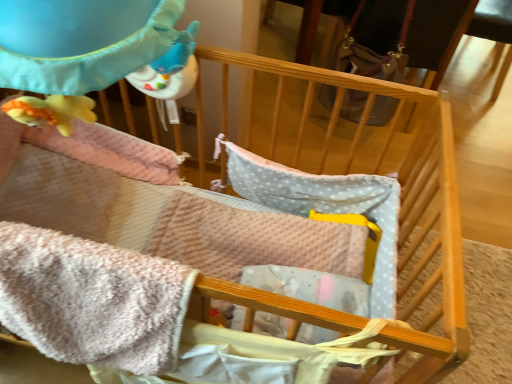
Question: Do you think leather-like brown bag at upper right is within pink plush blanket at lower left, or outside of it?

Choices:
 (A) inside
 (B) outside

Answer: (B)

Question: Is leather-like brown bag at upper right in front of or behind pink plush blanket at lower left in the image?

Choices:
 (A) behind
 (B) front

Answer: (A)

Question: From a real-world perspective, is leather-like brown bag at upper right above or below pink plush blanket at lower left?

Choices:
 (A) above
 (B) below

Answer: (B)

Question: In the image, is pink plush blanket at lower left on the left side or the right side of leather-like brown bag at upper right?

Choices:
 (A) left
 (B) right

Answer: (A)

Question: Relative to leather-like brown bag at upper right, is pink plush blanket at lower left in front or behind?

Choices:
 (A) behind
 (B) front

Answer: (B)

Question: From the image's perspective, is pink plush blanket at lower left located above or below leather-like brown bag at upper right?

Choices:
 (A) below
 (B) above

Answer: (A)

Question: Is pink plush blanket at lower left situated inside leather-like brown bag at upper right or outside?

Choices:
 (A) outside
 (B) inside

Answer: (A)